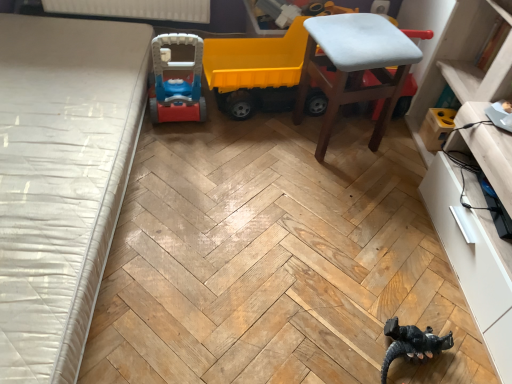
Locate an element on the screen. The image size is (512, 384). free point behind black matte toy dinosaur at lower right is located at coordinates (403, 291).